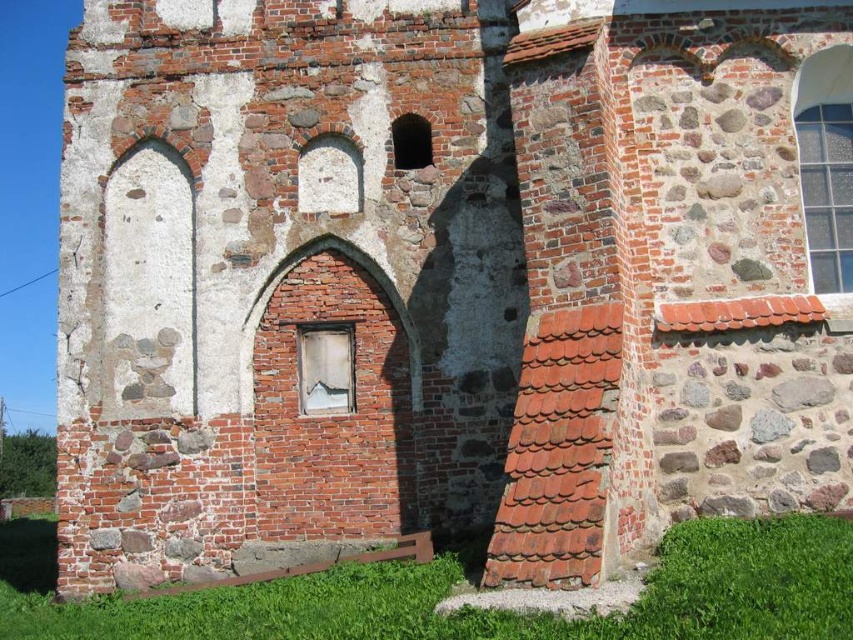
Question: Which object is farther from the camera taking this photo?

Choices:
 (A) clear glass window at upper right
 (B) smooth stone arch at center
 (C) transparent glass window at center

Answer: (B)

Question: Is the position of clear glass window at upper right more distant than that of smooth stone arch at center?

Choices:
 (A) yes
 (B) no

Answer: (B)

Question: Does clear glass window at upper right appear on the left side of transparent glass window at center?

Choices:
 (A) yes
 (B) no

Answer: (B)

Question: Does clear glass window at upper right have a lesser width compared to smooth stone arch at center?

Choices:
 (A) no
 (B) yes

Answer: (B)

Question: Which is nearer to the clear glass window at upper right?

Choices:
 (A) transparent glass window at center
 (B) smooth stone arch at center

Answer: (B)

Question: Which of the following is the farthest from the observer?

Choices:
 (A) (415, 147)
 (B) (821, 136)

Answer: (A)